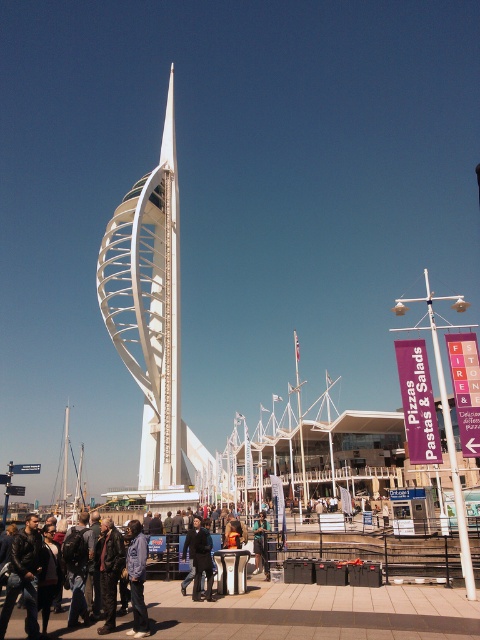
Does white metallic spire at center appear over denim jacket at lower left?

Yes, white metallic spire at center is above denim jacket at lower left.

Between point (136, 365) and point (144, 616), which one is positioned behind?

The point (136, 365) is more distant.

Which is in front, point (165, 205) or point (136, 627)?

Point (136, 627) is more forward.

Locate an element on the screen. The height and width of the screenshot is (640, 480). white metallic spire at center is located at coordinates (148, 307).

Is denim jacket at lower left shorter than dark blue jacket at center?

No.

Who is more forward, (136, 520) or (190, 561)?

Point (190, 561)

Locate an element on the screen. The image size is (480, 640). denim jacket at lower left is located at coordinates (136, 579).

Is white metallic spire at center above dark blue jacket at center?

Correct, white metallic spire at center is located above dark blue jacket at center.

The image size is (480, 640). What are the coordinates of `white metallic spire at center` in the screenshot? It's located at (148, 307).

Find the location of a particular element. The height and width of the screenshot is (640, 480). white metallic spire at center is located at coordinates click(x=148, y=307).

Find the location of a particular element. The height and width of the screenshot is (640, 480). white metallic spire at center is located at coordinates (148, 307).